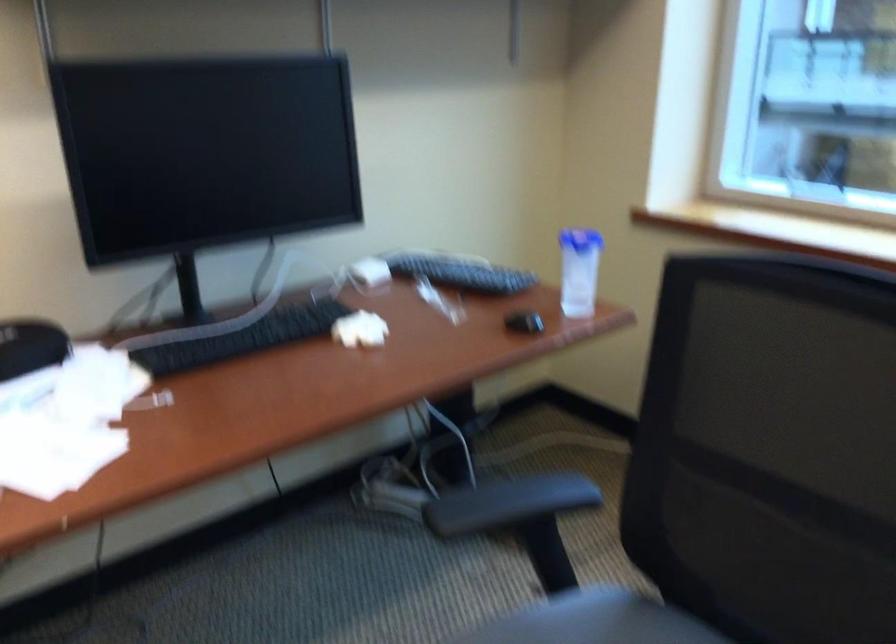
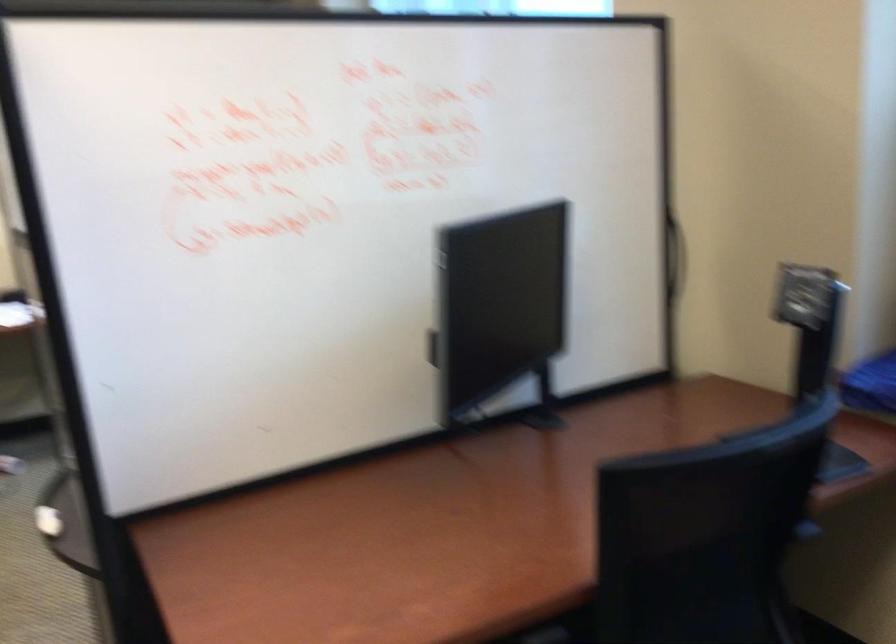
Consider the image. Which direction would the cameraman need to move to produce the second image?

The cameraman walked toward right, backward.